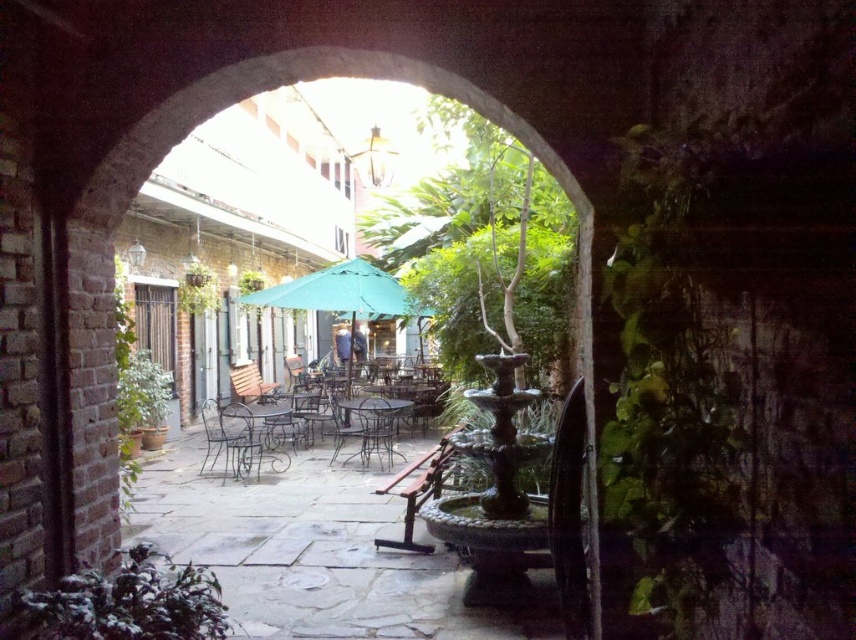
Which of these two, metallic black table at center or metallic silver chair at center, stands taller?

With more height is metallic black table at center.

Is the position of metallic black table at center less distant than that of metallic silver chair at center?

Yes, it is in front of metallic silver chair at center.

Is point (361, 452) behind point (308, 422)?

No, (361, 452) is closer to viewer.

At what (x,y) coordinates should I click in order to perform the action: click on metallic black table at center. Please return your answer as a coordinate pair (x, y). The image size is (856, 640). Looking at the image, I should click on (372, 428).

Does metallic wrought iron chair at center have a greater height compared to metallic silver chair at center?

In fact, metallic wrought iron chair at center may be shorter than metallic silver chair at center.

Between point (242, 467) and point (331, 401), which one is positioned in front?

Point (242, 467)

Does point (224, 416) lie in front of point (318, 406)?

Yes.

At what (x,y) coordinates should I click in order to perform the action: click on metallic wrought iron chair at center. Please return your answer as a coordinate pair (x, y). Looking at the image, I should click on (229, 436).

Measure the distance between metallic wrought iron chair at center and camera.

The distance of metallic wrought iron chair at center from camera is 8.64 meters.

Who is shorter, metallic wrought iron chair at center or metallic black table at center?

metallic wrought iron chair at center is shorter.

Who is more distant from viewer, (247,458) or (361,444)?

The point (361,444) is behind.

The image size is (856, 640). What are the coordinates of `metallic wrought iron chair at center` in the screenshot? It's located at (229, 436).